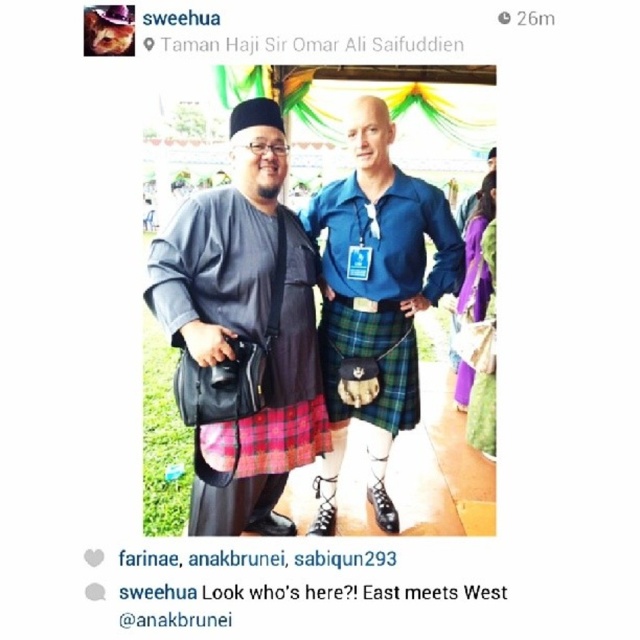
You are a photographer trying to capture a closeup of the blue plaid kilt at center. Given that your camera has a focal length of 50mm and you are currently 3 meters away from the kilt, would you need to move closer or farther away to ensure the kilt fills the frame properly?

The blue plaid kilt at center is positioned at point coordinates, but without knowing the exact dimensions of the kilt or the camera sensor size, it is impossible to determine the required distance adjustment. Please provide more details about the kilt size or camera specifications.

Based on the scene described, which kilt is shorter in length between the matte black kilt at center and the blue plaid kilt at center?

The matte black kilt at center is shorter than the blue plaid kilt at center.